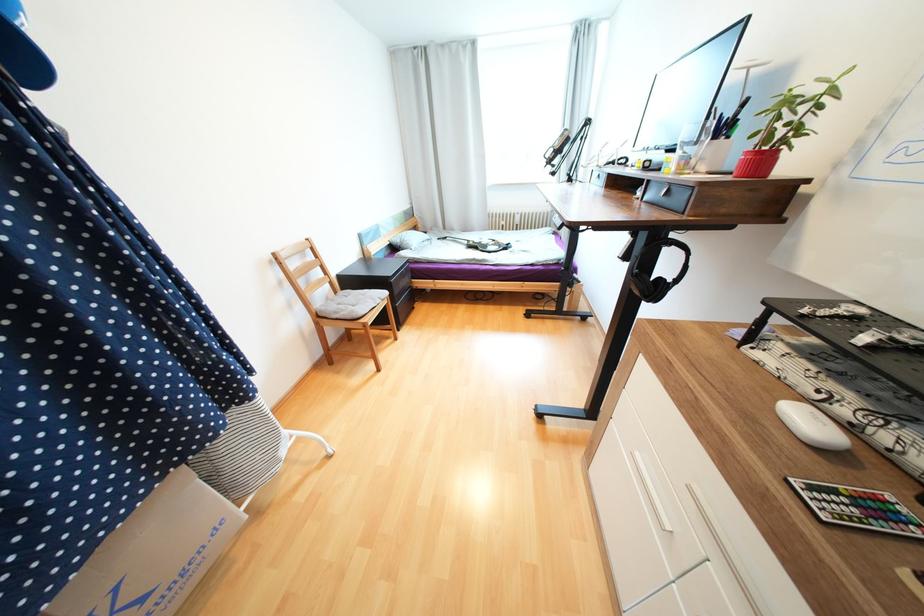
Which object does [690,143] point to?

It refers to a drinking glass.